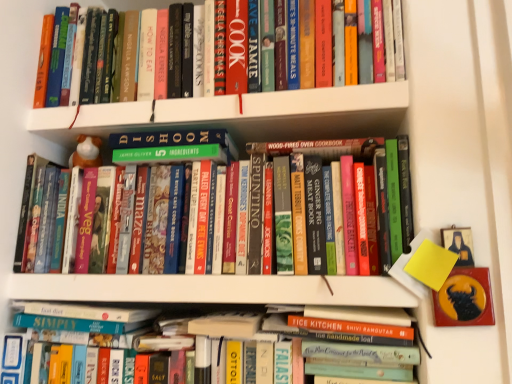
Question: Are hardcover books at center, which is the second book from top to bottom, and white glossy bookshelf at upper center located far from each other?

Choices:
 (A) no
 (B) yes

Answer: (A)

Question: From a real-world perspective, is hardcover books at center, the 2th book positioned from the bottom, under white glossy bookshelf at upper center?

Choices:
 (A) yes
 (B) no

Answer: (A)

Question: From a real-world perspective, is hardcover books at center, the 2th book positioned from the bottom, on top of white glossy bookshelf at upper center?

Choices:
 (A) yes
 (B) no

Answer: (B)

Question: Is hardcover books at center, the 2th book positioned from the bottom, positioned before white glossy bookshelf at upper center?

Choices:
 (A) no
 (B) yes

Answer: (B)

Question: Considering the relative sizes of hardcover books at center, which is the second book from top to bottom, and white glossy bookshelf at upper center in the image provided, is hardcover books at center, which is the second book from top to bottom, smaller than white glossy bookshelf at upper center?

Choices:
 (A) yes
 (B) no

Answer: (B)

Question: Do you think white glossy bookshelf at upper center is within hardcover books at center, the 2th book positioned from the bottom, or outside of it?

Choices:
 (A) outside
 (B) inside

Answer: (A)

Question: Is point (276, 102) closer or farther from the camera than point (399, 150)?

Choices:
 (A) closer
 (B) farther

Answer: (B)

Question: From a real-world perspective, relative to hardcover books at center, which is the second book from top to bottom, is white glossy bookshelf at upper center vertically above or below?

Choices:
 (A) below
 (B) above

Answer: (B)

Question: Is white glossy bookshelf at upper center taller or shorter than hardcover books at center, the 2th book positioned from the bottom?

Choices:
 (A) short
 (B) tall

Answer: (A)

Question: In terms of width, does hardcover books at upper center, which appears as the third book when ordered from the bottom, look wider or thinner when compared to hardcover books at center, which is the second book from top to bottom?

Choices:
 (A) thin
 (B) wide

Answer: (B)

Question: In terms of size, does hardcover books at upper center, the first book in the top-to-bottom sequence, appear bigger or smaller than hardcover books at center, which is the second book from top to bottom?

Choices:
 (A) small
 (B) big

Answer: (B)

Question: In terms of height, does hardcover books at upper center, the first book in the top-to-bottom sequence, look taller or shorter compared to hardcover books at center, which is the second book from top to bottom?

Choices:
 (A) tall
 (B) short

Answer: (B)

Question: From the image's perspective, is hardcover books at upper center, which appears as the third book when ordered from the bottom, positioned above or below hardcover books at center, the 2th book positioned from the bottom?

Choices:
 (A) below
 (B) above

Answer: (B)

Question: Relative to white glossy bookshelf at upper center, is hardcover books at center, the 2th book positioned from the bottom, in front or behind?

Choices:
 (A) front
 (B) behind

Answer: (A)

Question: Is hardcover books at center, the 2th book positioned from the bottom, inside or outside of white glossy bookshelf at upper center?

Choices:
 (A) outside
 (B) inside

Answer: (A)